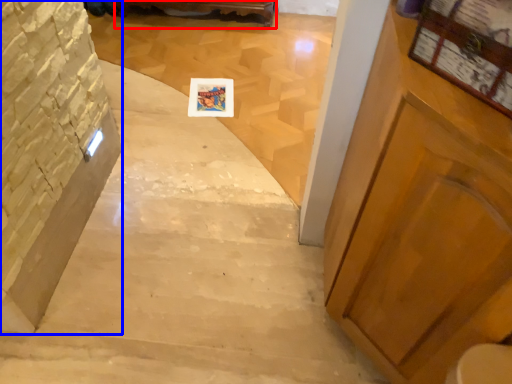
Question: Which object is further to the camera taking this photo, furniture (highlighted by a red box) or stairwell (highlighted by a blue box)?

Choices:
 (A) furniture
 (B) stairwell

Answer: (A)